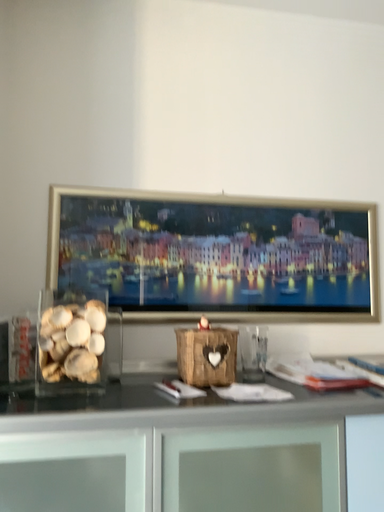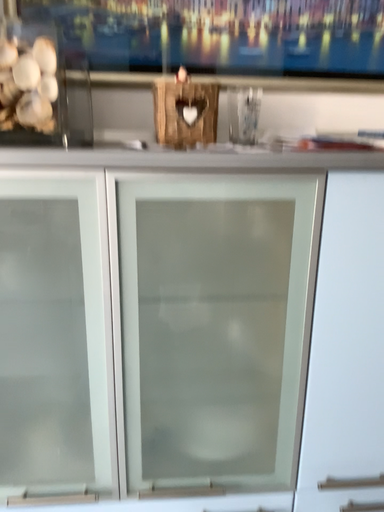
Question: Which way did the camera rotate in the video?

Choices:
 (A) rotated upward
 (B) rotated downward

Answer: (B)